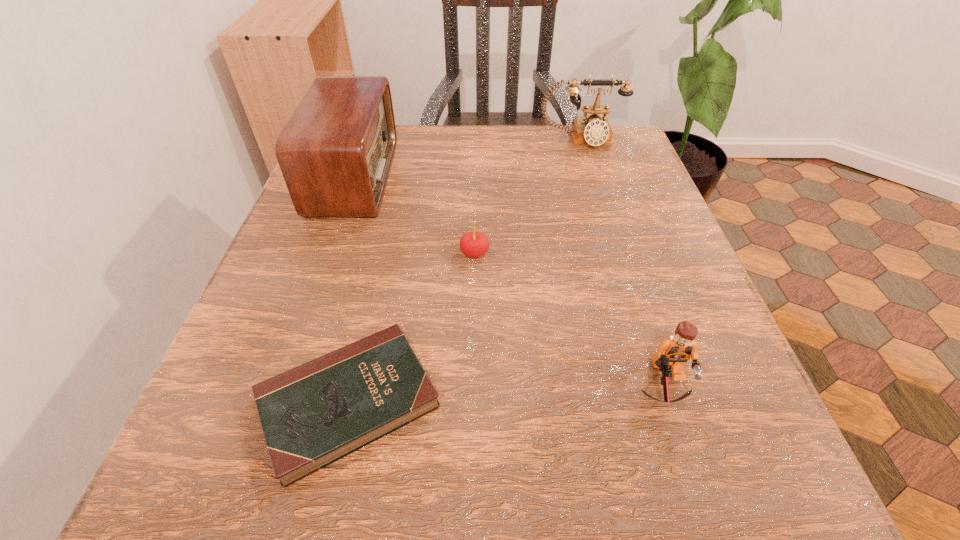
Image resolution: width=960 pixels, height=540 pixels. Find the location of `free spot between the Lego and the radio receiver`. free spot between the Lego and the radio receiver is located at coordinates (510, 281).

Find the location of a particular element. vacant space that is in between the cherry and the shortest object is located at coordinates (412, 328).

Image resolution: width=960 pixels, height=540 pixels. What are the coordinates of `free point between the telephone and the radio receiver` in the screenshot? It's located at (468, 158).

Where is `unoccupied position between the radio receiver and the Lego`? unoccupied position between the radio receiver and the Lego is located at coordinates (510, 281).

Where is `free space between the telephone and the Lego`? This screenshot has height=540, width=960. free space between the telephone and the Lego is located at coordinates (623, 262).

Identify which object is located as the fourth nearest to the Bible. Please provide its 2D coordinates. Your answer should be formatted as a tuple, i.e. [(x, y)], where the tuple contains the x and y coordinates of a point satisfying the conditions above.

[(594, 130)]

Locate an element on the screen. Image resolution: width=960 pixels, height=540 pixels. object that is the closest one to the radio receiver is located at coordinates (473, 244).

Where is `free location that satisfies the following two spatial constraints: 1. on the front panel of the radio receiver; 2. on the back side of the shortest object`? The image size is (960, 540). free location that satisfies the following two spatial constraints: 1. on the front panel of the radio receiver; 2. on the back side of the shortest object is located at coordinates (276, 402).

At what (x,y) coordinates should I click in order to perform the action: click on free space that satisfies the following two spatial constraints: 1. on the dial number of the telephone; 2. on the front panel of the radio receiver. Please return your answer as a coordinate pair (x, y). The width and height of the screenshot is (960, 540). Looking at the image, I should click on (593, 177).

In order to click on blank space that satisfies the following two spatial constraints: 1. on the back side of the third nearest object; 2. on the front panel of the radio receiver in this screenshot , I will do point(475,177).